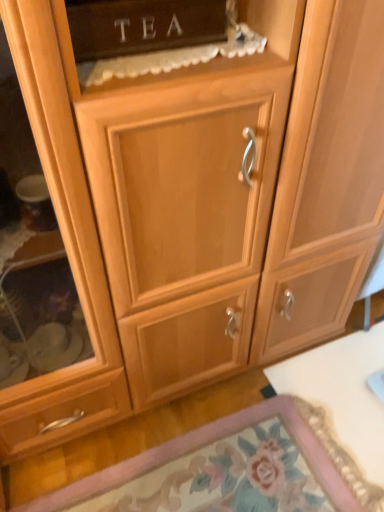
Question: Considering their positions, is matte wood tea cabinet at upper center located in front of or behind wooden cabinet door at lower center?

Choices:
 (A) front
 (B) behind

Answer: (A)

Question: In the image, is matte wood tea cabinet at upper center on the left side or the right side of wooden cabinet door at lower center?

Choices:
 (A) right
 (B) left

Answer: (B)

Question: Considering the real-world distances, which object is farthest from the wooden cabinet door at lower center?

Choices:
 (A) matte wood tea cabinet at upper center
 (B) white glossy table at lower right

Answer: (A)

Question: Estimate the real-world distances between objects in this image. Which object is closer to the wooden cabinet door at lower center?

Choices:
 (A) white glossy table at lower right
 (B) matte wood tea cabinet at upper center

Answer: (A)